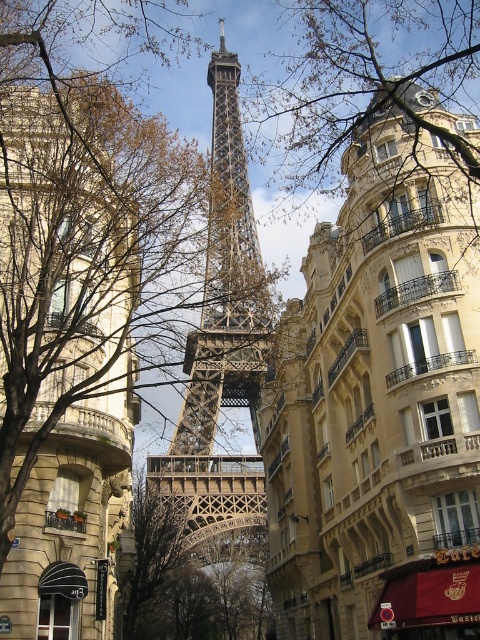
Question: Can you confirm if brown leafless branches at center is bigger than metallic lattice structure at center?

Choices:
 (A) no
 (B) yes

Answer: (B)

Question: Estimate the real-world distances between objects in this image. Which object is farther from the metallic lattice structure at center?

Choices:
 (A) golden stone building at center
 (B) brown leafless branches at center

Answer: (B)

Question: Estimate the real-world distances between objects in this image. Which object is farther from the golden stone building at center?

Choices:
 (A) metallic lattice structure at center
 (B) brown leafless branches at center

Answer: (B)

Question: Is the position of golden stone building at center more distant than that of metallic lattice structure at center?

Choices:
 (A) yes
 (B) no

Answer: (B)

Question: Among these objects, which one is nearest to the camera?

Choices:
 (A) brown leafless branches at center
 (B) metallic lattice structure at center

Answer: (A)

Question: Can you confirm if golden stone building at center is positioned to the right of metallic lattice structure at center?

Choices:
 (A) yes
 (B) no

Answer: (A)